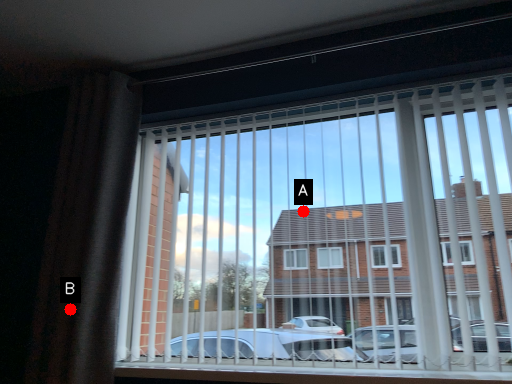
Question: Two points are circled on the image, labeled by A and B beside each circle. Which point is further to the camera?

Choices:
 (A) A is further
 (B) B is further

Answer: (A)